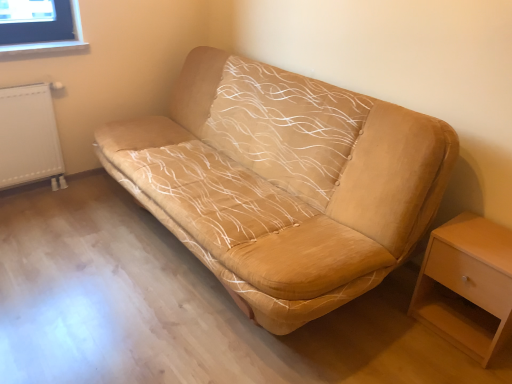
Question: Can you confirm if light wood/wooden nightstand at lower right is positioned to the left of white textured radiator at left?

Choices:
 (A) yes
 (B) no

Answer: (B)

Question: Is light wood/wooden nightstand at lower right not inside white textured radiator at left?

Choices:
 (A) no
 (B) yes

Answer: (B)

Question: Is the position of light wood/wooden nightstand at lower right less distant than that of white textured radiator at left?

Choices:
 (A) yes
 (B) no

Answer: (A)

Question: Considering the relative sizes of light wood/wooden nightstand at lower right and white textured radiator at left in the image provided, is light wood/wooden nightstand at lower right shorter than white textured radiator at left?

Choices:
 (A) yes
 (B) no

Answer: (A)

Question: Does light wood/wooden nightstand at lower right appear on the right side of white textured radiator at left?

Choices:
 (A) yes
 (B) no

Answer: (A)

Question: Considering the positions of beige suede sofa at center and white textured radiator at left in the image, is beige suede sofa at center wider or thinner than white textured radiator at left?

Choices:
 (A) thin
 (B) wide

Answer: (B)

Question: From a real-world perspective, is beige suede sofa at center physically located above or below white textured radiator at left?

Choices:
 (A) below
 (B) above

Answer: (B)

Question: Do you think beige suede sofa at center is within white textured radiator at left, or outside of it?

Choices:
 (A) inside
 (B) outside

Answer: (B)

Question: Relative to white textured radiator at left, is beige suede sofa at center in front or behind?

Choices:
 (A) front
 (B) behind

Answer: (A)

Question: Considering the positions of light wood/wooden nightstand at lower right and white textured radiator at left in the image, is light wood/wooden nightstand at lower right taller or shorter than white textured radiator at left?

Choices:
 (A) tall
 (B) short

Answer: (B)

Question: In terms of width, does light wood/wooden nightstand at lower right look wider or thinner when compared to white textured radiator at left?

Choices:
 (A) thin
 (B) wide

Answer: (B)

Question: Considering the relative positions of light wood/wooden nightstand at lower right and white textured radiator at left in the image provided, is light wood/wooden nightstand at lower right to the left or to the right of white textured radiator at left?

Choices:
 (A) right
 (B) left

Answer: (A)

Question: From the image's perspective, is light wood/wooden nightstand at lower right positioned above or below white textured radiator at left?

Choices:
 (A) below
 (B) above

Answer: (A)

Question: Is point pyautogui.click(x=417, y=289) closer or farther from the camera than point pyautogui.click(x=130, y=170)?

Choices:
 (A) closer
 (B) farther

Answer: (A)

Question: From a real-world perspective, relative to beige suede sofa at center, is light wood/wooden nightstand at lower right vertically above or below?

Choices:
 (A) below
 (B) above

Answer: (A)